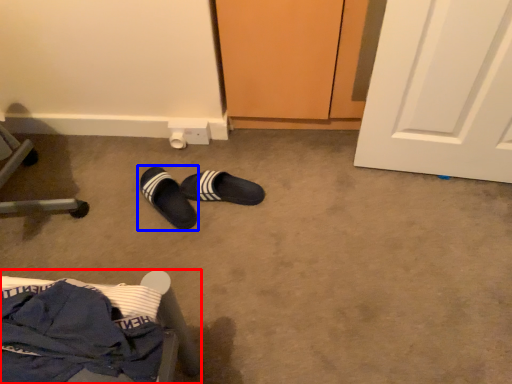
Question: Which object is closer to the camera taking this photo, furniture (highlighted by a red box) or footwear (highlighted by a blue box)?

Choices:
 (A) furniture
 (B) footwear

Answer: (A)